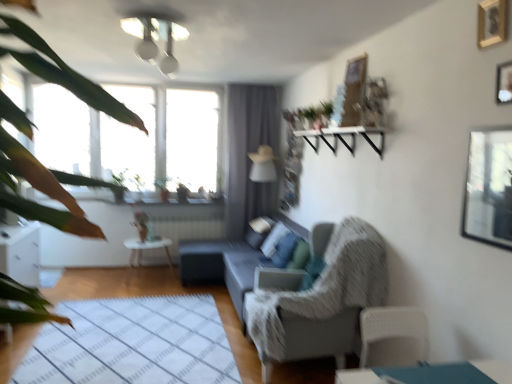
Question: Can you confirm if white glossy light fixture at upper center is smaller than transparent glass window screen at upper right?

Choices:
 (A) no
 (B) yes

Answer: (A)

Question: From a real-world perspective, is white glossy light fixture at upper center under transparent glass window screen at upper right?

Choices:
 (A) yes
 (B) no

Answer: (B)

Question: From the image's perspective, is white glossy light fixture at upper center beneath transparent glass window screen at upper right?

Choices:
 (A) yes
 (B) no

Answer: (B)

Question: Considering the relative sizes of white glossy light fixture at upper center and transparent glass window screen at upper right in the image provided, is white glossy light fixture at upper center bigger than transparent glass window screen at upper right?

Choices:
 (A) no
 (B) yes

Answer: (B)

Question: From the image's perspective, is white glossy light fixture at upper center on top of transparent glass window screen at upper right?

Choices:
 (A) no
 (B) yes

Answer: (B)

Question: Looking at the image, does matte gray couch at center seem bigger or smaller compared to wooden picture frame at upper right, the 2th picture frame viewed from the top?

Choices:
 (A) big
 (B) small

Answer: (A)

Question: From a real-world perspective, is matte gray couch at center physically located above or below wooden picture frame at upper right, the 2th picture frame viewed from the top?

Choices:
 (A) above
 (B) below

Answer: (B)

Question: Is point (289, 226) positioned closer to the camera than point (498, 71)?

Choices:
 (A) closer
 (B) farther

Answer: (B)

Question: Is matte gray couch at center inside the boundaries of wooden picture frame at upper right, which is the 1th picture frame in bottom-to-top order, or outside?

Choices:
 (A) outside
 (B) inside

Answer: (A)

Question: Does point pos(147,246) appear closer or farther from the camera than point pos(57,195)?

Choices:
 (A) closer
 (B) farther

Answer: (B)

Question: From a real-world perspective, relative to green leafy plant at left, is white glossy side table at center vertically above or below?

Choices:
 (A) below
 (B) above

Answer: (A)

Question: Do you think white glossy side table at center is within green leafy plant at left, or outside of it?

Choices:
 (A) inside
 (B) outside

Answer: (B)

Question: Considering their positions, is white glossy side table at center located in front of or behind green leafy plant at left?

Choices:
 (A) behind
 (B) front

Answer: (A)

Question: Is textured gray armchair at center in front of or behind wooden picture frame at upper right, which is the 1th picture frame in bottom-to-top order, in the image?

Choices:
 (A) behind
 (B) front

Answer: (A)

Question: From the image's perspective, is textured gray armchair at center located above or below wooden picture frame at upper right, the 2th picture frame viewed from the top?

Choices:
 (A) above
 (B) below

Answer: (B)